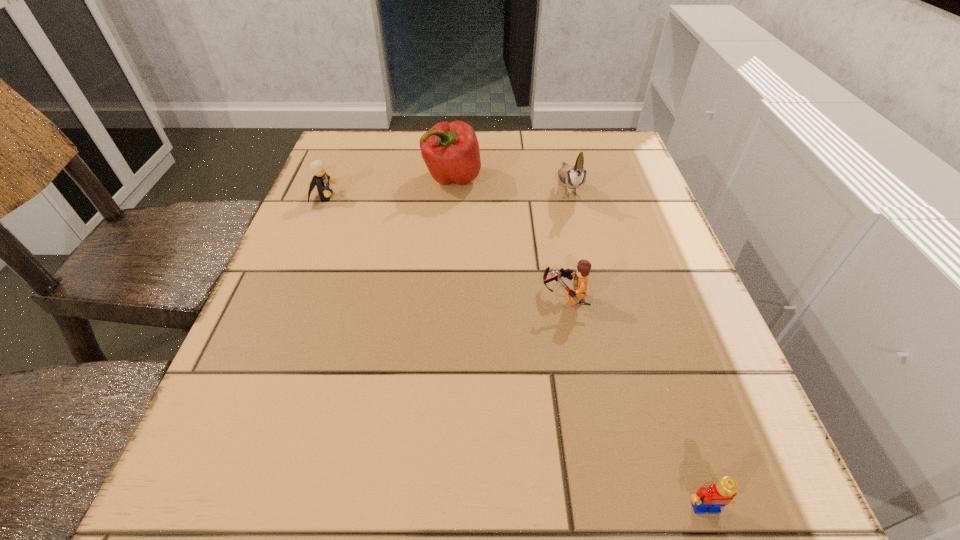
Point out which Lego is positioned as the nearest to the bell pepper. Please provide its 2D coordinates. Your answer should be formatted as a tuple, i.e. [(x, y)], where the tuple contains the x and y coordinates of a point satisfying the conditions above.

[(320, 179)]

Image resolution: width=960 pixels, height=540 pixels. Find the location of `vacant space that satisfies the following two spatial constraints: 1. at the face of the bird; 2. on the front-facing side of the farthest Lego`. vacant space that satisfies the following two spatial constraints: 1. at the face of the bird; 2. on the front-facing side of the farthest Lego is located at coordinates (570, 197).

Locate an element on the screen. This screenshot has height=540, width=960. vacant space that satisfies the following two spatial constraints: 1. on the front side of the second object from left to right; 2. on the front-facing side of the farthest Lego is located at coordinates (450, 197).

What are the coordinates of `free space in the image that satisfies the following two spatial constraints: 1. at the face of the bird; 2. holding a crossbow in the hands of the second Lego from left to right` in the screenshot? It's located at (594, 296).

Locate an element on the screen. This screenshot has height=540, width=960. vacant space that satisfies the following two spatial constraints: 1. on the front side of the fourth object from right to left; 2. on the front-facing side of the farthest Lego is located at coordinates (450, 197).

Locate an element on the screen. This screenshot has width=960, height=540. free location that satisfies the following two spatial constraints: 1. at the face of the bird; 2. holding a crossbow in the hands of the second Lego from left to right is located at coordinates coord(594,296).